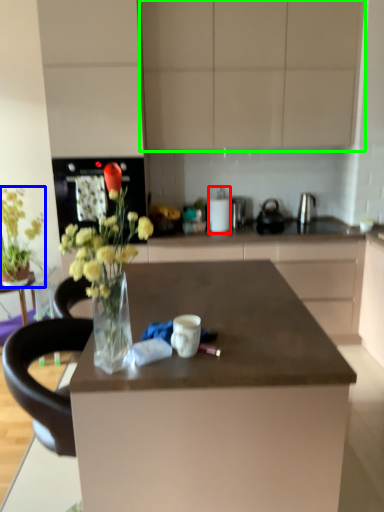
Question: Which is farther away from appliance (highlighted by a red box)? flower (highlighted by a blue box) or cabinetry (highlighted by a green box)?

Choices:
 (A) flower
 (B) cabinetry

Answer: (A)